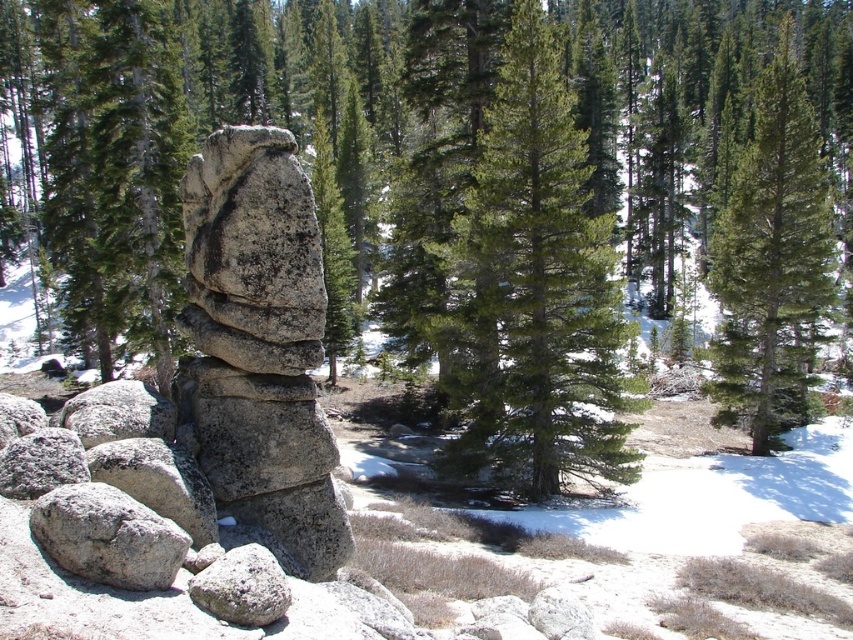
Consider the image. You are standing in front of the gray rough rock at center and want to take a photo of the green matte tree at upper right. Which object is closer to you when you point your camera towards the tree?

The gray rough rock at center is closer to the viewer than the green matte tree at upper right, so the rock will appear in front of the tree in the photo.

Based on the coordinates provided, where is the green matte tree at center located in the image?

The green matte tree at center is located at point coordinates of (534, 289).